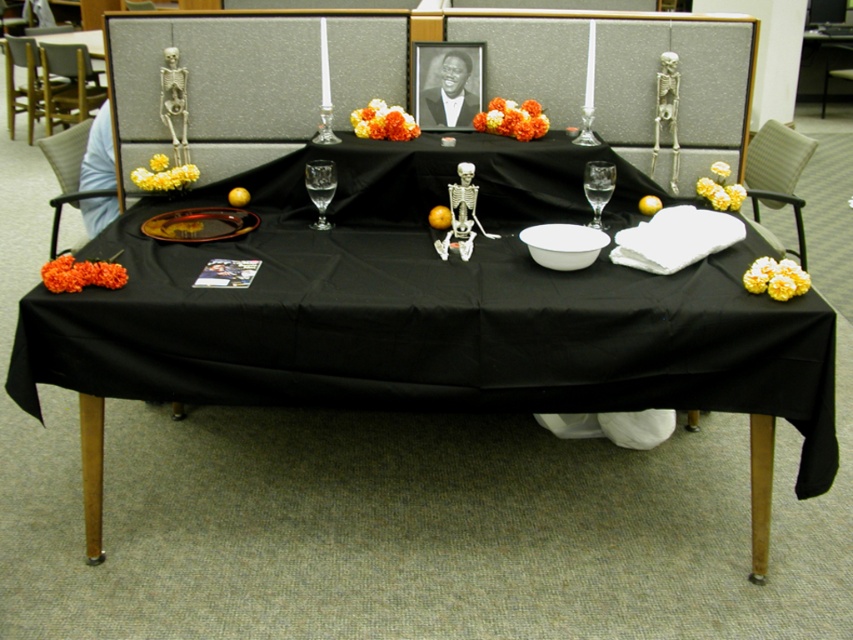
Consider the image. Can you confirm if black matte table at center is bigger than yellow matte/orange fruit at center?

Yes, black matte table at center is bigger than yellow matte/orange fruit at center.

This screenshot has height=640, width=853. What do you see at coordinates (431, 310) in the screenshot? I see `black matte table at center` at bounding box center [431, 310].

I want to click on black matte table at center, so (431, 310).

Which is in front, point (457, 99) or point (241, 189)?

Positioned in front is point (241, 189).

Does point (421, 67) come closer to viewer compared to point (236, 195)?

That is False.

Locate an element on the screen. The image size is (853, 640). metallic silver picture frame at center is located at coordinates (447, 83).

Who is more forward, [305,172] or [648,212]?

Point [648,212]

Who is taller, transparent glass wine glass at center or orange matte/orange at center?

With more height is transparent glass wine glass at center.

The image size is (853, 640). Describe the element at coordinates (320, 188) in the screenshot. I see `transparent glass wine glass at center` at that location.

The height and width of the screenshot is (640, 853). Identify the location of transparent glass wine glass at center. (320, 188).